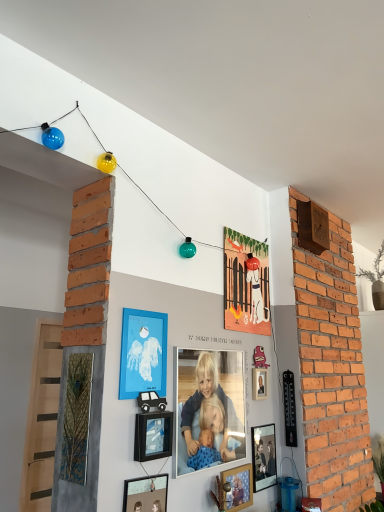
Question: Does matte paper picture frame at upper center, the sixth picture frame when ordered from front to back, turn towards black matte picture frame at center, the 5th picture frame from the back?

Choices:
 (A) no
 (B) yes

Answer: (A)

Question: Is black matte picture frame at center, the 5th picture frame from the back, at the back of matte paper picture frame at upper center, acting as the first picture frame starting from the back?

Choices:
 (A) no
 (B) yes

Answer: (A)

Question: Does matte paper picture frame at upper center, acting as the first picture frame starting from the back, appear on the left side of black matte picture frame at center, the 5th picture frame from the back?

Choices:
 (A) no
 (B) yes

Answer: (A)

Question: Is matte paper picture frame at upper center, the sixth picture frame when ordered from front to back, placed right next to black matte picture frame at center, the 5th picture frame from the back?

Choices:
 (A) no
 (B) yes

Answer: (A)

Question: From the image's perspective, does matte paper picture frame at upper center, the sixth picture frame when ordered from front to back, appear lower than black matte picture frame at center, the 5th picture frame from the back?

Choices:
 (A) no
 (B) yes

Answer: (A)

Question: From a real-world perspective, is matte paper picture frame at upper center, the sixth picture frame when ordered from front to back, under black matte picture frame at center, the 5th picture frame from the back?

Choices:
 (A) yes
 (B) no

Answer: (B)

Question: Considering the relative sizes of matte paper picture frame at upper center, acting as the first picture frame starting from the back, and green leafy plant at upper right in the image provided, is matte paper picture frame at upper center, acting as the first picture frame starting from the back, wider than green leafy plant at upper right?

Choices:
 (A) yes
 (B) no

Answer: (B)

Question: Is matte paper picture frame at upper center, the sixth picture frame when ordered from front to back, positioned behind green leafy plant at upper right?

Choices:
 (A) no
 (B) yes

Answer: (A)

Question: Does matte paper picture frame at upper center, acting as the first picture frame starting from the back, have a lesser height compared to green leafy plant at upper right?

Choices:
 (A) no
 (B) yes

Answer: (B)

Question: Does matte paper picture frame at upper center, the sixth picture frame when ordered from front to back, have a lesser width compared to green leafy plant at upper right?

Choices:
 (A) no
 (B) yes

Answer: (B)

Question: From a real-world perspective, does matte paper picture frame at upper center, the sixth picture frame when ordered from front to back, sit lower than green leafy plant at upper right?

Choices:
 (A) no
 (B) yes

Answer: (B)

Question: From the image's perspective, is matte paper picture frame at upper center, acting as the first picture frame starting from the back, beneath green leafy plant at upper right?

Choices:
 (A) no
 (B) yes

Answer: (B)

Question: Considering the relative sizes of wooden photo frame at lower center, placed as the third picture frame when sorted from back to front, and matte black picture frame at lower center, acting as the sixth picture frame starting from the back, in the image provided, is wooden photo frame at lower center, placed as the third picture frame when sorted from back to front, shorter than matte black picture frame at lower center, acting as the sixth picture frame starting from the back,?

Choices:
 (A) no
 (B) yes

Answer: (B)